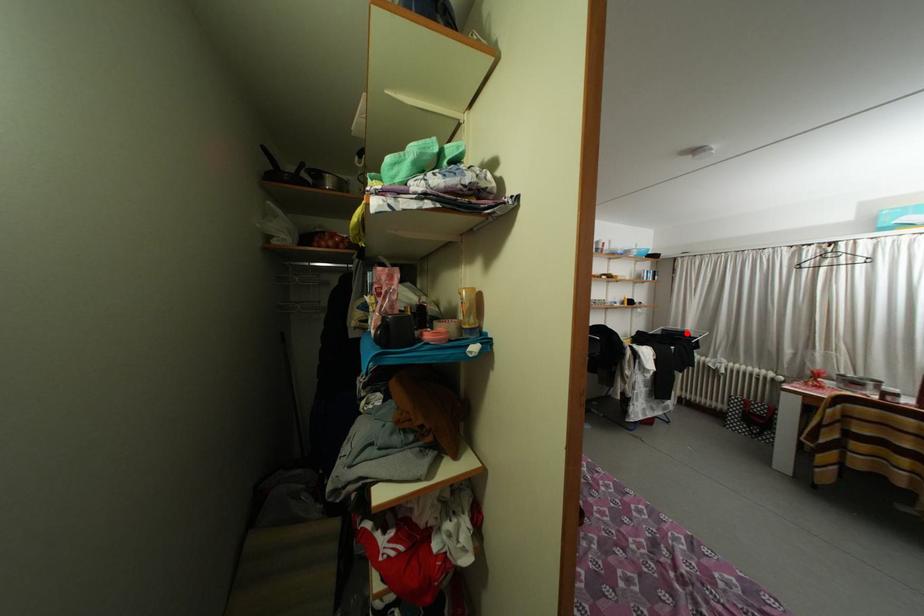
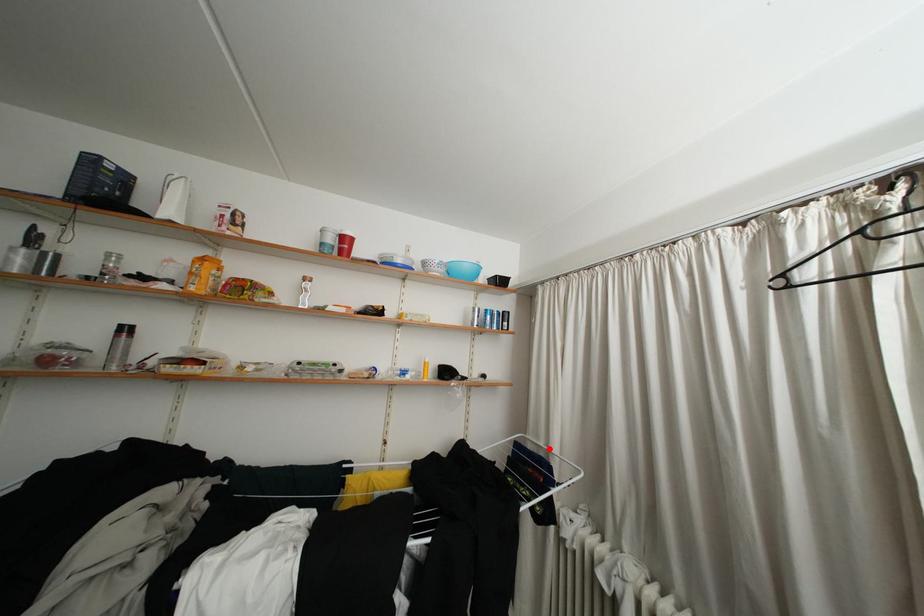
I am providing you with two images of the same scene from different viewpoints. A red point is marked on the first image and another point is marked on the second image. Are the points marked in image1 and image2 representing the same 3D position?

Yes